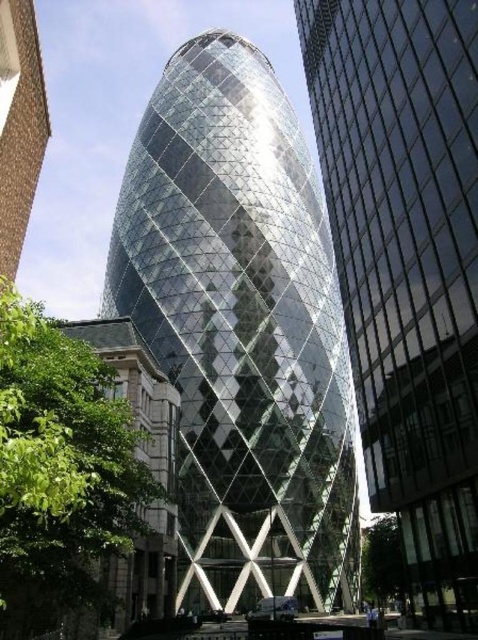
You are a tourist standing in the park and see the transparent glass tower at center and the green leafy tree at lower right. Which object is higher in the image?

The transparent glass tower at center is located above the green leafy tree at lower right, so it is higher in the image.

You are a drone operator tasked with capturing aerial footage of the transparent glass tower at center. To ensure the best shot, you need to position your drone directly above the tower. Given the coordinates provided, what are the exact coordinates where you should position your drone?

The transparent glass tower at center is located at point (241, 330), so you should position your drone directly above these coordinates at (241, 330) to capture the best shot.

From the picture: You are an urban planner assessing the impact of new construction on the city skyline. You observe the transparent glass tower at center and the transparent glass skyscraper at center. Which of these two buildings has a greater width?

The transparent glass tower at center has a greater width than the transparent glass skyscraper at center according to the description provided.